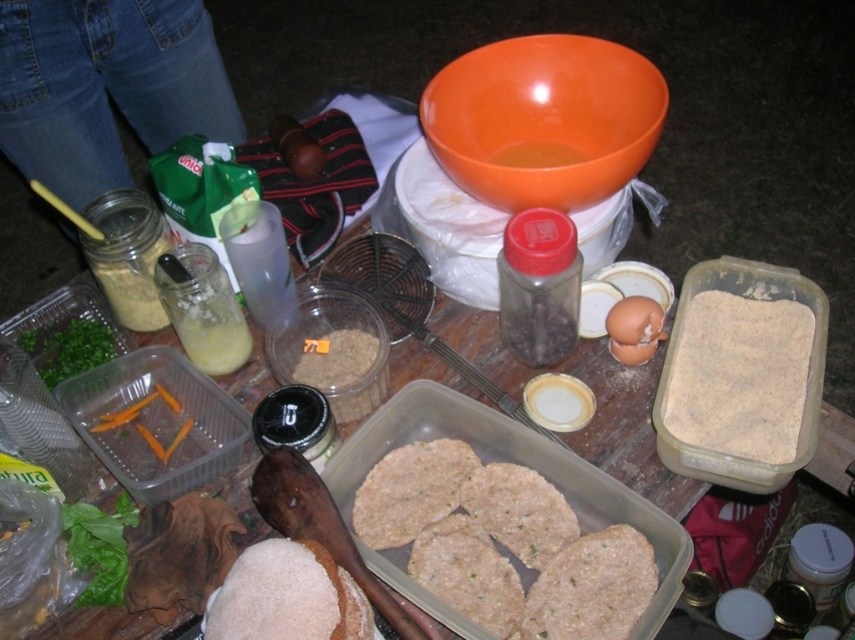
Based on the photo, you are standing at the picnic table and need to reach two points to retrieve items. The first point is at coordinates point (623, 557) and the second is at point (705, 301). Which point should you reach first to minimize the distance traveled?

You should reach point (623, 557) first because it is in front of point (705, 301), so it is closer to you.

You are setting up a cooking station and need to place the brown textured patties at center and the brown powder at center in a specific order. According to the scene, which object is located to the left of the other?

The brown textured patties at center are positioned to the left of the brown powder at center.

You are setting up a cooking station and need to access both the brown textured patties at center and the brown powder at center. Which item is easier to reach without moving any other items?

The brown textured patties at center is closer to the viewer than the brown powder at center, so it is easier to reach without moving other items.